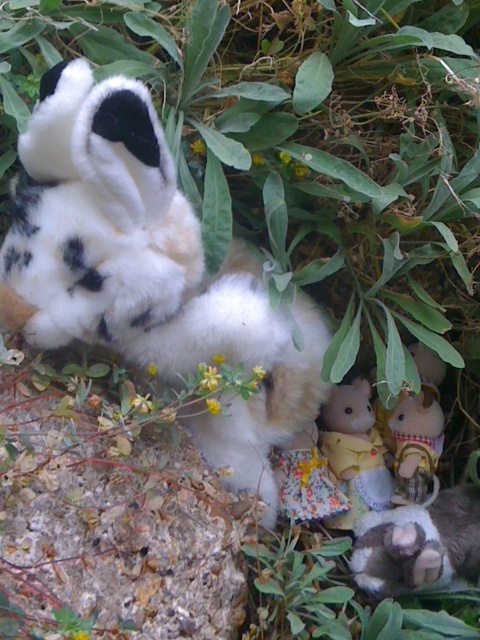
Does plush fabric doll at lower right have a greater width compared to floral fabric doll at center?

Correct, the width of plush fabric doll at lower right exceeds that of floral fabric doll at center.

Can you confirm if plush fabric doll at lower right is thinner than floral fabric doll at center?

No, plush fabric doll at lower right is not thinner than floral fabric doll at center.

From the picture: Who is more forward, (x=411, y=440) or (x=297, y=461)?

Point (x=297, y=461)

Locate an element on the screen. This screenshot has height=640, width=480. plush fabric doll at lower right is located at coordinates (416, 432).

Is fluffy fabric doll at center closer to the viewer compared to plush fabric doll at lower right?

That is True.

Is fluffy fabric doll at center to the left of plush fabric doll at lower right from the viewer's perspective?

Yes, fluffy fabric doll at center is to the left of plush fabric doll at lower right.

What do you see at coordinates (147, 269) in the screenshot? The width and height of the screenshot is (480, 640). I see `fluffy fabric doll at center` at bounding box center [147, 269].

Image resolution: width=480 pixels, height=640 pixels. I want to click on fluffy fabric doll at center, so click(147, 269).

Between point (212, 337) and point (460, 518), which one is positioned in front?

Point (212, 337) is in front.

This screenshot has height=640, width=480. Describe the element at coordinates (147, 269) in the screenshot. I see `fluffy fabric doll at center` at that location.

Between point (220, 342) and point (451, 579), which one is positioned behind?

The point (451, 579) is more distant.

You are a GUI agent. You are given a task and a screenshot of the screen. Output one action in this format:
    pyautogui.click(x=<x>, y=<y>)
    Task: Click on the fluffy fabric doll at center
    
    Given the screenshot: What is the action you would take?
    pyautogui.click(x=147, y=269)